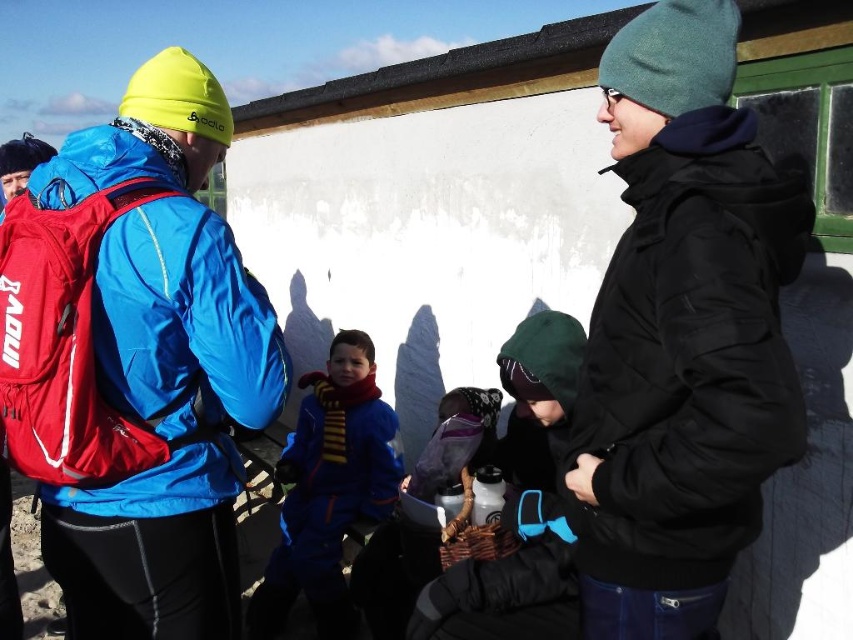
Question: Can you confirm if matte blue jacket at left is bigger than blue fleece jacket at center?

Choices:
 (A) yes
 (B) no

Answer: (B)

Question: Does black matte jacket at right have a larger size compared to dark green hooded jacket at center?

Choices:
 (A) yes
 (B) no

Answer: (B)

Question: Is dark green hooded jacket at center positioned before blue fleece jacket at center?

Choices:
 (A) yes
 (B) no

Answer: (A)

Question: Which of the following is the farthest from the observer?

Choices:
 (A) (402, 557)
 (B) (320, 536)

Answer: (B)

Question: Estimate the real-world distances between objects in this image. Which object is closer to the black matte jacket at right?

Choices:
 (A) matte blue jacket at left
 (B) blue fleece jacket at center

Answer: (A)

Question: Which point is farther from the camera taking this photo?

Choices:
 (A) (94, 198)
 (B) (637, 584)
 (C) (357, 394)
 (D) (369, 612)

Answer: (C)